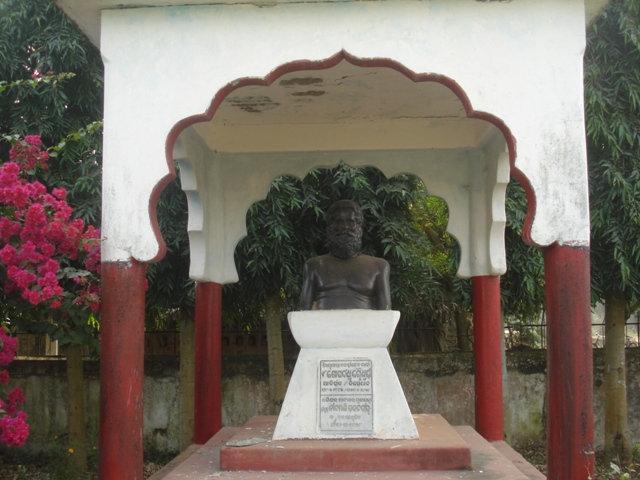
You are a GUI agent. You are given a task and a screenshot of the screen. Output one action in this format:
    pyautogui.click(x=<x>, y=<y>)
    Task: Click on the wall
    
    Given the screenshot: What is the action you would take?
    pyautogui.click(x=433, y=397)